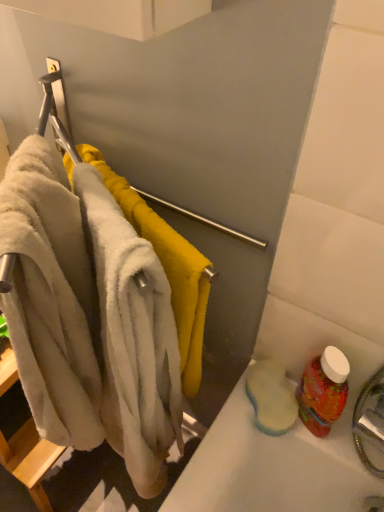
Question: From a real-world perspective, is soft white towel at left beneath red plastic bottle at lower right?

Choices:
 (A) yes
 (B) no

Answer: (B)

Question: Is the depth of soft white towel at left greater than that of red plastic bottle at lower right?

Choices:
 (A) no
 (B) yes

Answer: (A)

Question: Is the depth of soft white towel at left less than that of red plastic bottle at lower right?

Choices:
 (A) yes
 (B) no

Answer: (A)

Question: Would you say soft white towel at left is outside red plastic bottle at lower right?

Choices:
 (A) no
 (B) yes

Answer: (B)

Question: From the image's perspective, would you say soft white towel at left is shown under red plastic bottle at lower right?

Choices:
 (A) no
 (B) yes

Answer: (A)

Question: Looking at their shapes, would you say beige fluffy bath towel at left is wider or thinner than soft white towel at left?

Choices:
 (A) wide
 (B) thin

Answer: (A)

Question: Relative to soft white towel at left, is beige fluffy bath towel at left in front or behind?

Choices:
 (A) front
 (B) behind

Answer: (A)

Question: From a real-world perspective, is beige fluffy bath towel at left positioned above or below soft white towel at left?

Choices:
 (A) below
 (B) above

Answer: (A)

Question: In terms of height, does beige fluffy bath towel at left look taller or shorter compared to soft white towel at left?

Choices:
 (A) short
 (B) tall

Answer: (B)

Question: Considering the relative positions of soft white towel at left and red plastic bottle at lower right in the image provided, is soft white towel at left to the left or to the right of red plastic bottle at lower right?

Choices:
 (A) left
 (B) right

Answer: (A)

Question: Considering the positions of soft white towel at left and red plastic bottle at lower right in the image, is soft white towel at left wider or thinner than red plastic bottle at lower right?

Choices:
 (A) wide
 (B) thin

Answer: (A)

Question: Is soft white towel at left inside or outside of red plastic bottle at lower right?

Choices:
 (A) inside
 (B) outside

Answer: (B)

Question: In terms of height, does soft white towel at left look taller or shorter compared to red plastic bottle at lower right?

Choices:
 (A) tall
 (B) short

Answer: (A)

Question: Would you say red plastic bottle at lower right is inside or outside soft white towel at left?

Choices:
 (A) inside
 (B) outside

Answer: (B)

Question: Is point (329, 370) positioned closer to the camera than point (200, 360)?

Choices:
 (A) farther
 (B) closer

Answer: (B)